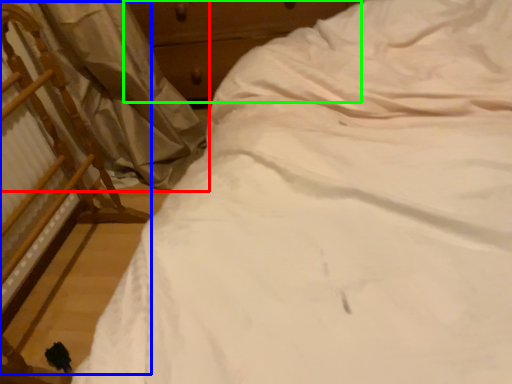
Question: Considering the real-world distances, which object is closest to curtain (highlighted by a red box)? chair (highlighted by a blue box) or dresser (highlighted by a green box).

Choices:
 (A) chair
 (B) dresser

Answer: (A)